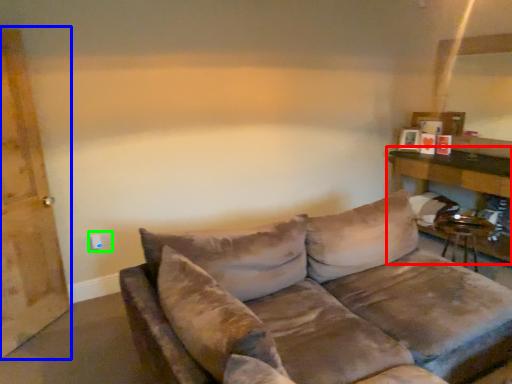
Question: Estimate the real-world distances between objects in this image. Which object is farther from table (highlighted by a red box), barn door (highlighted by a blue box) or electric outlet (highlighted by a green box)?

Choices:
 (A) barn door
 (B) electric outlet

Answer: (A)